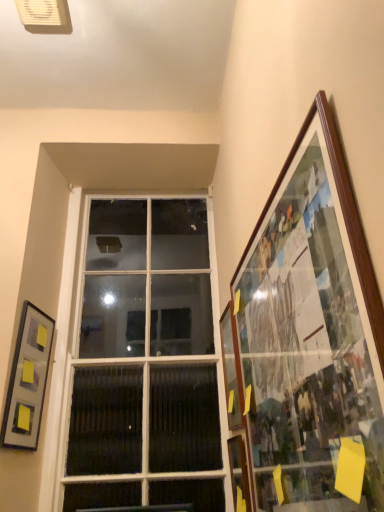
Question: Is matte gray picture frame at left, marked as the 3th picture frame in a right-to-left arrangement, further to the viewer compared to white glass window at center?

Choices:
 (A) yes
 (B) no

Answer: (B)

Question: Is white glass window at center at the back of matte gray picture frame at left, the 1th picture frame when ordered from left to right?

Choices:
 (A) yes
 (B) no

Answer: (B)

Question: Is matte gray picture frame at left, the 1th picture frame when ordered from left to right, not near white glass window at center?

Choices:
 (A) no
 (B) yes

Answer: (A)

Question: From the image's perspective, is matte gray picture frame at left, the 1th picture frame when ordered from left to right, beneath white glass window at center?

Choices:
 (A) yes
 (B) no

Answer: (A)

Question: Is matte gray picture frame at left, the 1th picture frame when ordered from left to right, surrounding white glass window at center?

Choices:
 (A) no
 (B) yes

Answer: (A)

Question: Considering the positions of white glass window at center and wooden picture frame at right, positioned as the second picture frame in right-to-left order, in the image, is white glass window at center bigger or smaller than wooden picture frame at right, positioned as the second picture frame in right-to-left order,?

Choices:
 (A) small
 (B) big

Answer: (B)

Question: In terms of width, does white glass window at center look wider or thinner when compared to wooden picture frame at right, which is counted as the second picture frame, starting from the left?

Choices:
 (A) wide
 (B) thin

Answer: (A)

Question: Is white glass window at center in front of or behind wooden picture frame at right, which is counted as the second picture frame, starting from the left, in the image?

Choices:
 (A) behind
 (B) front

Answer: (A)

Question: Is point (76, 421) closer or farther from the camera than point (236, 422)?

Choices:
 (A) farther
 (B) closer

Answer: (A)

Question: Considering the positions of matte gray picture frame at left, the 1th picture frame when ordered from left to right, and wooden-framed collage at right, which is the 3th picture frame from left to right, in the image, is matte gray picture frame at left, the 1th picture frame when ordered from left to right, bigger or smaller than wooden-framed collage at right, which is the 3th picture frame from left to right,?

Choices:
 (A) small
 (B) big

Answer: (A)

Question: Would you say matte gray picture frame at left, the 1th picture frame when ordered from left to right, is to the left or to the right of wooden-framed collage at right, which is the 3th picture frame from left to right, in the picture?

Choices:
 (A) left
 (B) right

Answer: (A)

Question: Is matte gray picture frame at left, the 1th picture frame when ordered from left to right, situated inside wooden-framed collage at right, which is the 3th picture frame from left to right, or outside?

Choices:
 (A) inside
 (B) outside

Answer: (B)

Question: From the image's perspective, is matte gray picture frame at left, marked as the 3th picture frame in a right-to-left arrangement, located above or below wooden-framed collage at right, which is the 3th picture frame from left to right?

Choices:
 (A) above
 (B) below

Answer: (B)

Question: Considering the positions of white glass window at center and wooden-framed collage at right, the 1th picture frame from the right, in the image, is white glass window at center bigger or smaller than wooden-framed collage at right, the 1th picture frame from the right,?

Choices:
 (A) big
 (B) small

Answer: (A)

Question: From the image's perspective, is white glass window at center above or below wooden-framed collage at right, which is the 3th picture frame from left to right?

Choices:
 (A) above
 (B) below

Answer: (B)